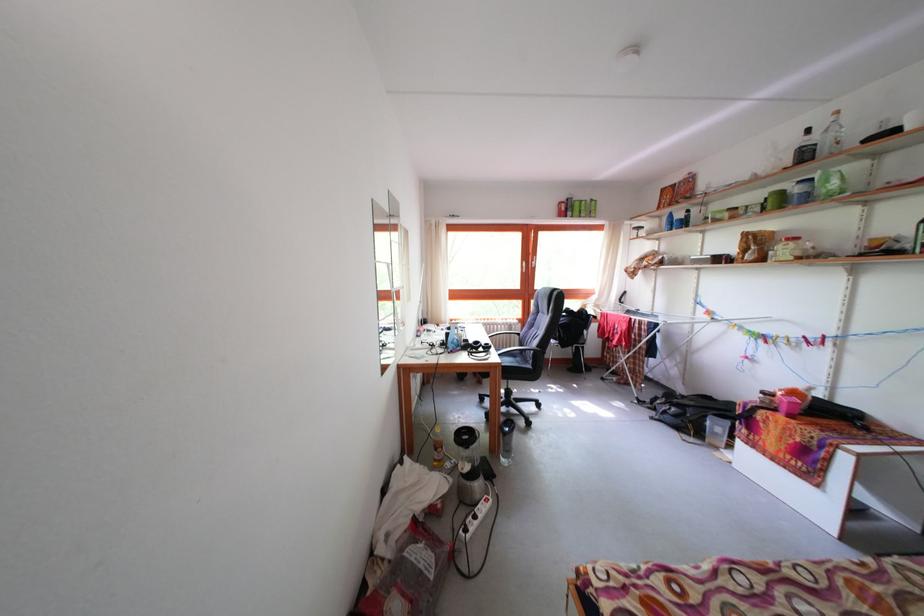
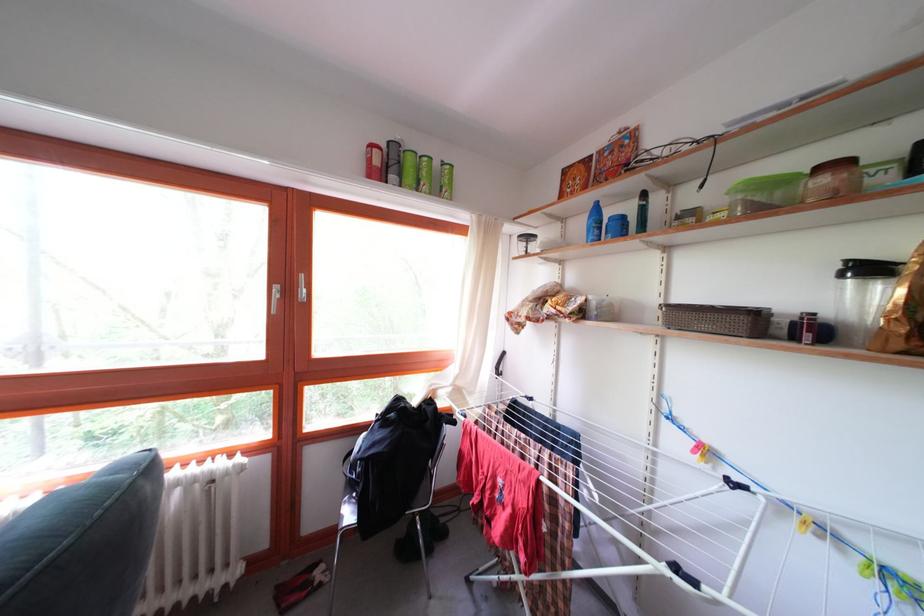
Find the pixel in the second image that matches (600,207) in the first image.

(452, 169)